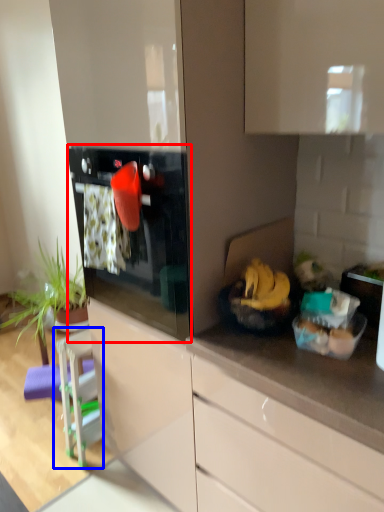
Question: Which object appears farthest to the camera in this image, oven (highlighted by a red box) or appliance (highlighted by a blue box)?

Choices:
 (A) oven
 (B) appliance

Answer: (B)